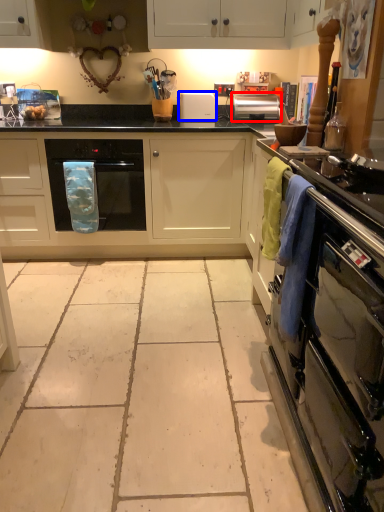
Question: Which object is closer to the camera taking this photo, kitchen appliance (highlighted by a red box) or appliance (highlighted by a blue box)?

Choices:
 (A) kitchen appliance
 (B) appliance

Answer: (A)